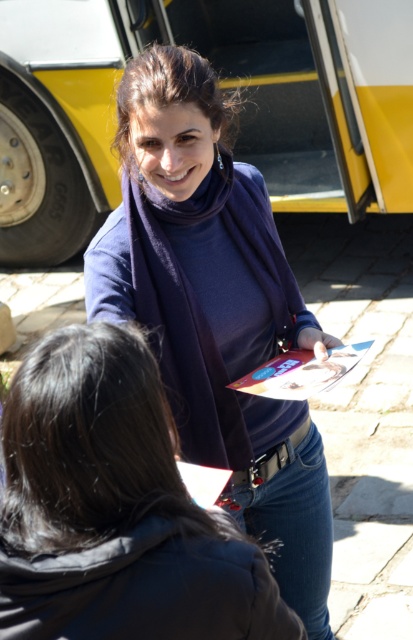
Question: Which object appears closest to the camera in this image?

Choices:
 (A) blue matte scarf at upper center
 (B) metallic silver belt at center

Answer: (A)

Question: Which of the following is the farthest from the observer?

Choices:
 (A) yellow matte bus at upper center
 (B) blue matte scarf at upper center
 (C) metallic silver belt at center
 (D) matte purple scarf at center

Answer: (A)

Question: Can you confirm if blue matte scarf at upper center is thinner than metallic silver belt at center?

Choices:
 (A) yes
 (B) no

Answer: (B)

Question: Which object is closer to the camera taking this photo?

Choices:
 (A) blue matte scarf at upper center
 (B) matte purple scarf at center
 (C) metallic silver belt at center

Answer: (A)

Question: Where is yellow matte bus at upper center located in relation to metallic silver belt at center in the image?

Choices:
 (A) above
 (B) below

Answer: (A)

Question: Is matte purple scarf at center to the right of blue matte scarf at upper center from the viewer's perspective?

Choices:
 (A) yes
 (B) no

Answer: (A)